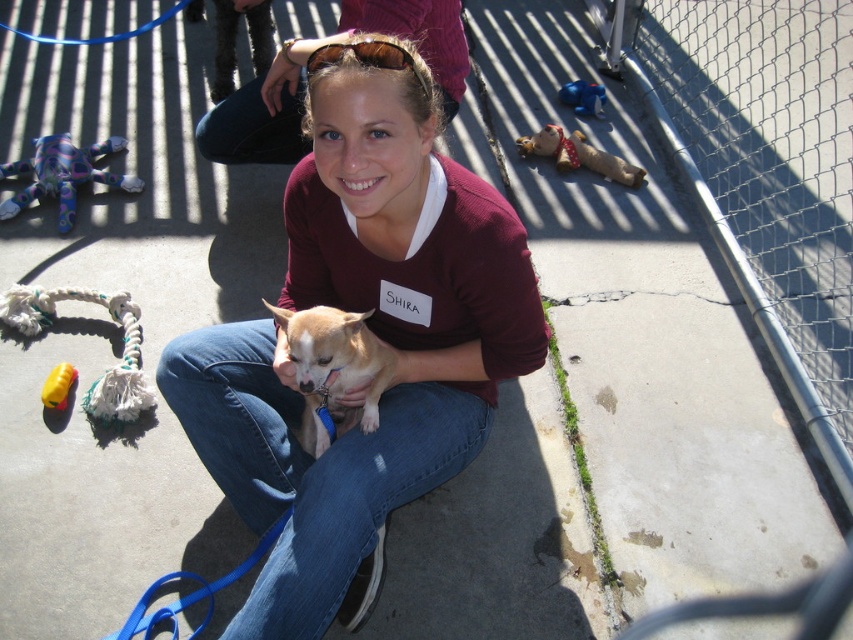
Based on the photo, you are a photographer trying to capture a clear shot of both the matte brown hair at upper center and the light brown fur at center. Based on their heights, which one should you focus on first to ensure both are in frame?

The matte brown hair at upper center is taller than the light brown fur at center, so you should focus on the matte brown hair at upper center first to ensure both are in frame.

You are a photographer trying to capture a clear photo of the brown fur dog at center without the matte maroon sweater at center blocking it. Based on their positions, is this possible?

The matte maroon sweater at center is in front of the brown fur dog at center, so it is blocking the view. To capture a clear photo of the brown fur dog at center without the matte maroon sweater at center blocking it, you would need to adjust your angle or position to move the sweater out of the frame or have the subject move so the dog is no longer behind the sweater.

You are trying to decide whether to place a small decorative box between the matte maroon sweater at center and the brown fur dog at center. Given their sizes, will the box fit comfortably between them?

The matte maroon sweater at center is larger than the brown fur dog at center. Therefore, there should be enough space to place a small decorative box between them comfortably.